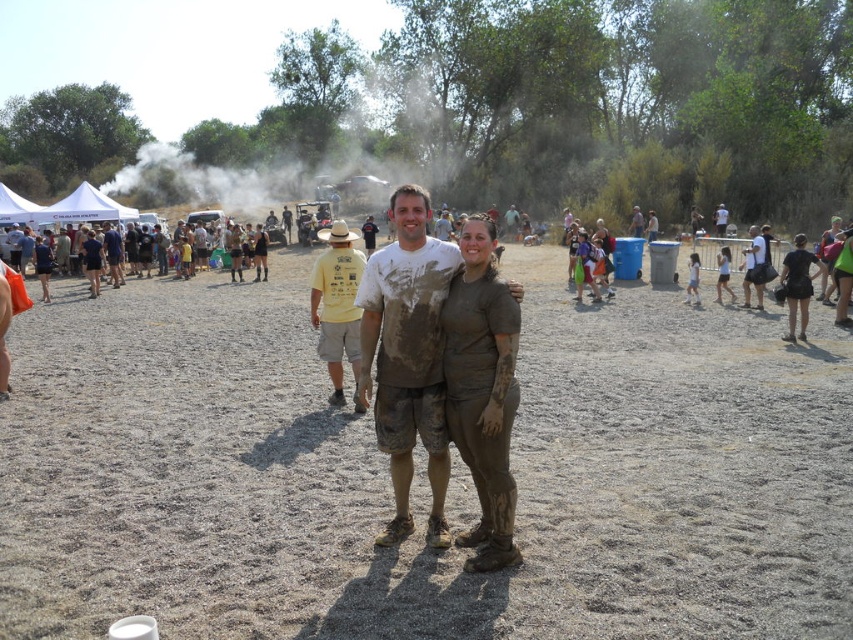
Question: In this image, where is dusty brown ground at center located relative to muddy t-shirt at center?

Choices:
 (A) above
 (B) below

Answer: (B)

Question: Which point is closer to the camera taking this photo?

Choices:
 (A) (375, 314)
 (B) (120, 180)
 (C) (322, 580)

Answer: (C)

Question: Among these objects, which one is nearest to the camera?

Choices:
 (A) white smoke at upper center
 (B) dusty brown ground at center
 (C) muddy t-shirt at center

Answer: (B)

Question: Which of the following is the farthest from the observer?

Choices:
 (A) (199, 124)
 (B) (556, 252)

Answer: (A)

Question: Is white smoke at upper center positioned behind muddy t-shirt at center?

Choices:
 (A) yes
 (B) no

Answer: (A)

Question: Can you confirm if white smoke at upper center is positioned above muddy t-shirt at center?

Choices:
 (A) yes
 (B) no

Answer: (A)